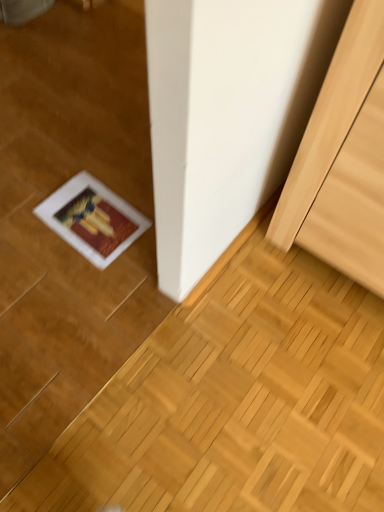
Find the location of a particular element. light wood cabinet at right is located at coordinates (343, 159).

Describe the element at coordinates (343, 159) in the screenshot. This screenshot has width=384, height=512. I see `light wood cabinet at right` at that location.

This screenshot has width=384, height=512. Identify the location of light wood cabinet at right. (343, 159).